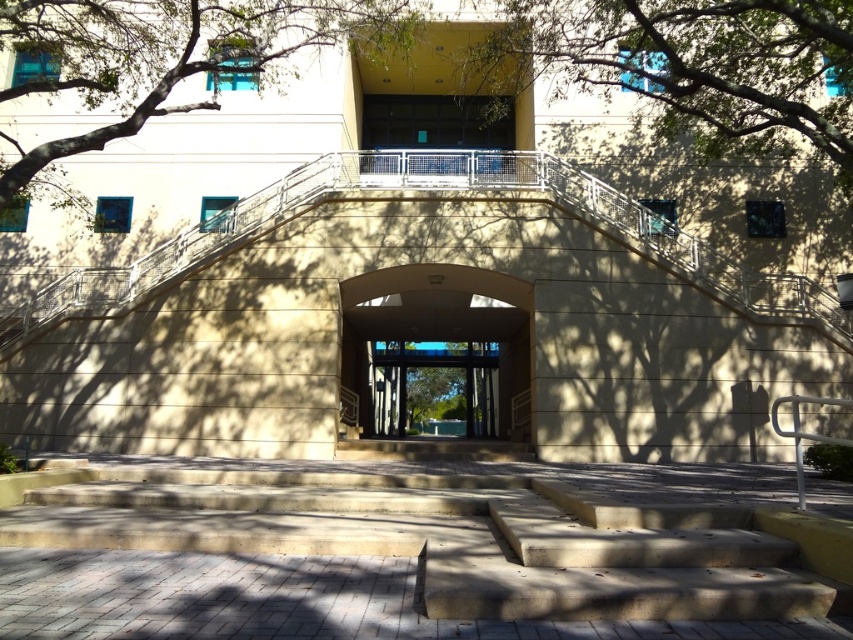
Question: Which of the following is the closest to the observer?

Choices:
 (A) clear glass doors at center
 (B) green leafy tree at upper center
 (C) beige stone archway at center

Answer: (C)

Question: Is concrete stairs at center smaller than green leafy tree at upper left?

Choices:
 (A) yes
 (B) no

Answer: (B)

Question: Which point is farther to the camera?

Choices:
 (A) clear glass doors at center
 (B) beige stone archway at center
 (C) concrete stairs at center

Answer: (A)

Question: Is concrete stairs at center to the right of green leafy tree at upper left from the viewer's perspective?

Choices:
 (A) yes
 (B) no

Answer: (A)

Question: Does concrete stairs at center have a lesser width compared to clear glass doors at center?

Choices:
 (A) yes
 (B) no

Answer: (A)

Question: Which object is closer to the camera taking this photo?

Choices:
 (A) green leafy tree at upper center
 (B) concrete stairs at center
 (C) beige stone archway at center

Answer: (B)